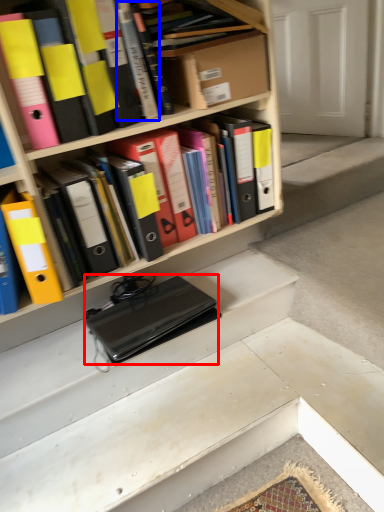
Question: Among these objects, which one is farthest to the camera, laptop (highlighted by a red box) or book (highlighted by a blue box)?

Choices:
 (A) laptop
 (B) book

Answer: (A)